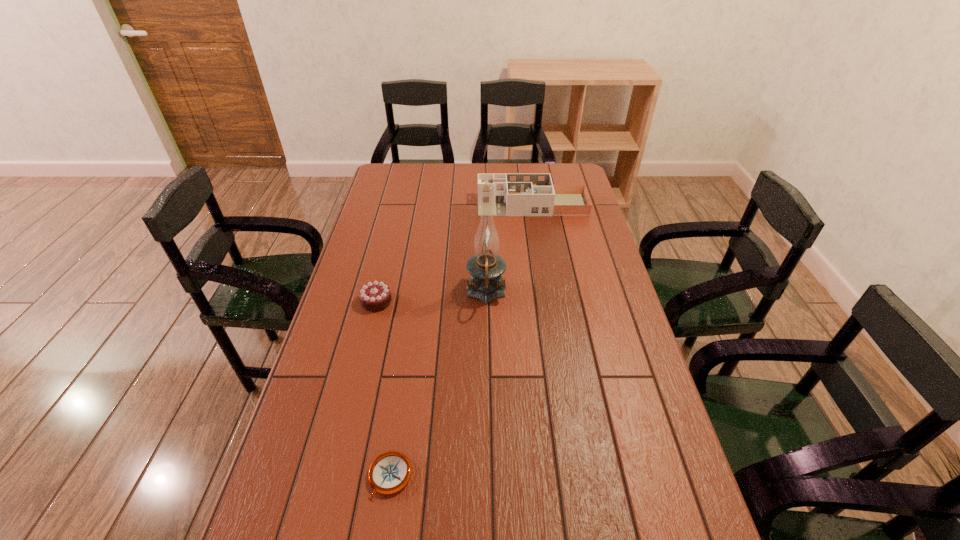
Where is `free space located 0.390m at the front door of the second tallest object`? This screenshot has width=960, height=540. free space located 0.390m at the front door of the second tallest object is located at coordinates (384, 205).

Locate an element on the screen. The width and height of the screenshot is (960, 540). blank space located on the back of the leftmost object is located at coordinates (392, 238).

Where is `free space located 0.350m on the right of the third object from right to left`? This screenshot has width=960, height=540. free space located 0.350m on the right of the third object from right to left is located at coordinates (566, 476).

Where is `object at the left edge`? object at the left edge is located at coordinates (374, 296).

Image resolution: width=960 pixels, height=540 pixels. Find the location of `object that is at the right edge`. object that is at the right edge is located at coordinates 513,194.

Where is `vacant space at the far edge of the desktop`? This screenshot has width=960, height=540. vacant space at the far edge of the desktop is located at coordinates (451, 181).

Image resolution: width=960 pixels, height=540 pixels. In the image, there is a desktop. What are the coordinates of `vacant space at the left edge` in the screenshot? It's located at (301, 465).

This screenshot has width=960, height=540. Find the location of `free space at the right edge of the desktop`. free space at the right edge of the desktop is located at coordinates (575, 221).

In order to click on free space at the far left corner in this screenshot , I will do `click(401, 186)`.

Identify the location of free space at the far right corner. This screenshot has width=960, height=540. (547, 164).